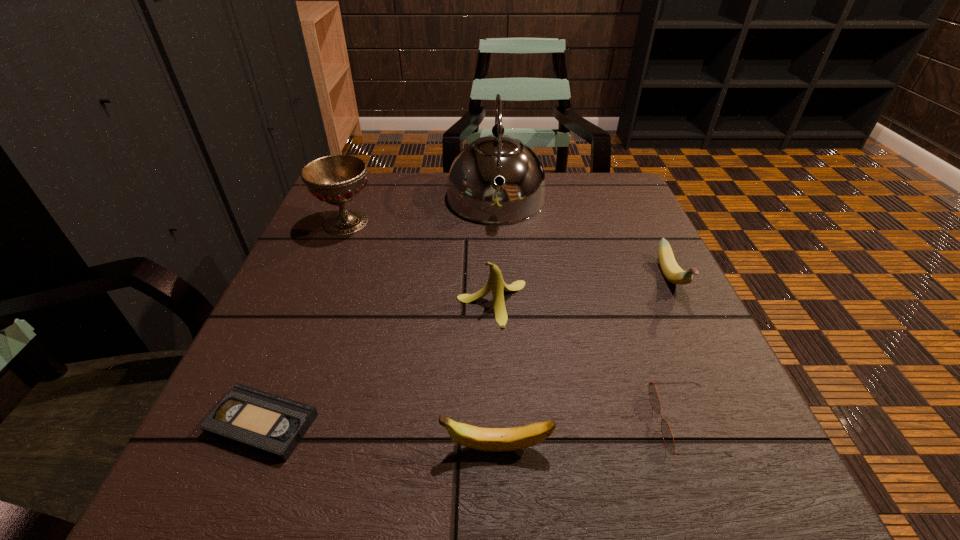
Identify the location of kettle. Image resolution: width=960 pixels, height=540 pixels. (472, 193).

Where is `the sixth shortest object`? the sixth shortest object is located at coordinates (338, 179).

Locate an element on the screen. The image size is (960, 540). the tallest banana is located at coordinates (495, 283).

Find the location of a particular element. This screenshot has height=540, width=960. the rightmost object is located at coordinates (671, 270).

Find the location of a particular element. the nearest banana is located at coordinates (484, 439).

The image size is (960, 540). What are the coordinates of `sunglasses` in the screenshot? It's located at (667, 435).

Locate an element on the screen. This screenshot has width=960, height=540. the second shortest object is located at coordinates (667, 435).

Where is `videotape`? The height and width of the screenshot is (540, 960). videotape is located at coordinates (271, 425).

Where is `blank space located from the spout of the tallest object`? This screenshot has height=540, width=960. blank space located from the spout of the tallest object is located at coordinates (502, 301).

Where is `free space located 0.180m on the front of the sixth shortest object`? The width and height of the screenshot is (960, 540). free space located 0.180m on the front of the sixth shortest object is located at coordinates (317, 295).